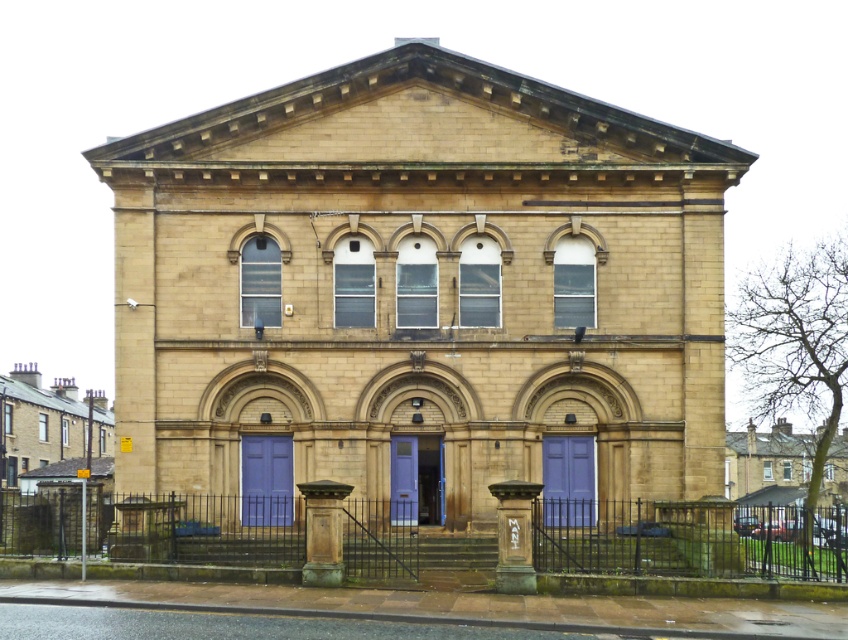
Consider the image. Who is taller, bronze stone pillar at lower center or purple matte door at center?

purple matte door at center

Is point (310, 563) behind point (400, 490)?

No, (310, 563) is in front of (400, 490).

What do you see at coordinates (322, 532) in the screenshot?
I see `bronze stone pillar at lower center` at bounding box center [322, 532].

I want to click on bronze stone pillar at lower center, so coord(322,532).

Is matte blue door at center below bronze stone pillar at lower center?

No, matte blue door at center is not below bronze stone pillar at lower center.

Can you confirm if matte blue door at center is taller than bronze stone pillar at lower center?

Indeed, matte blue door at center has a greater height compared to bronze stone pillar at lower center.

You are a GUI agent. You are given a task and a screenshot of the screen. Output one action in this format:
    pyautogui.click(x=<x>, y=<y>)
    Task: Click on the matte blue door at center
    The height and width of the screenshot is (640, 848).
    Given the screenshot: What is the action you would take?
    click(x=568, y=481)

Does matte blue door at center have a greater width compared to purple matte door at center?

Correct, the width of matte blue door at center exceeds that of purple matte door at center.

This screenshot has height=640, width=848. What are the coordinates of `matte blue door at center` in the screenshot? It's located at (568, 481).